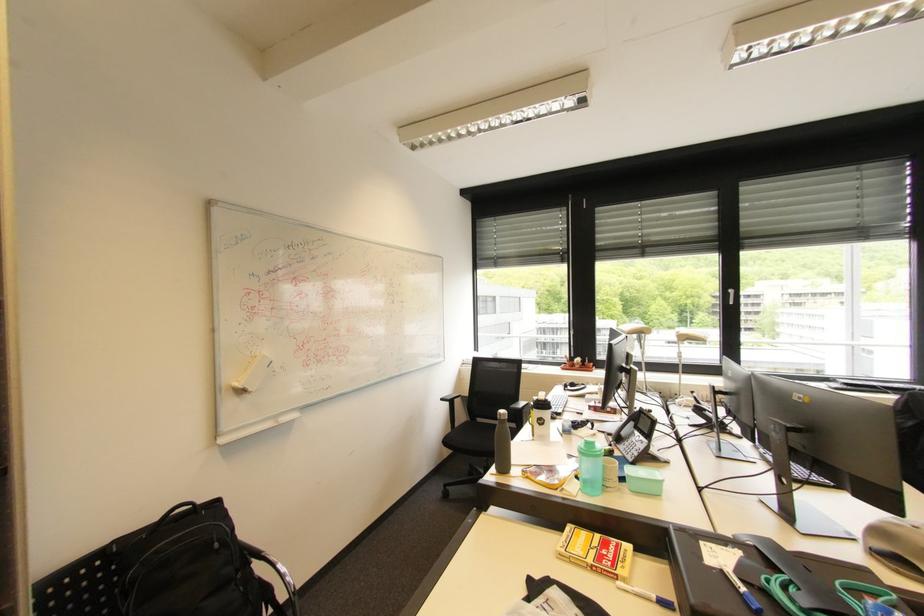
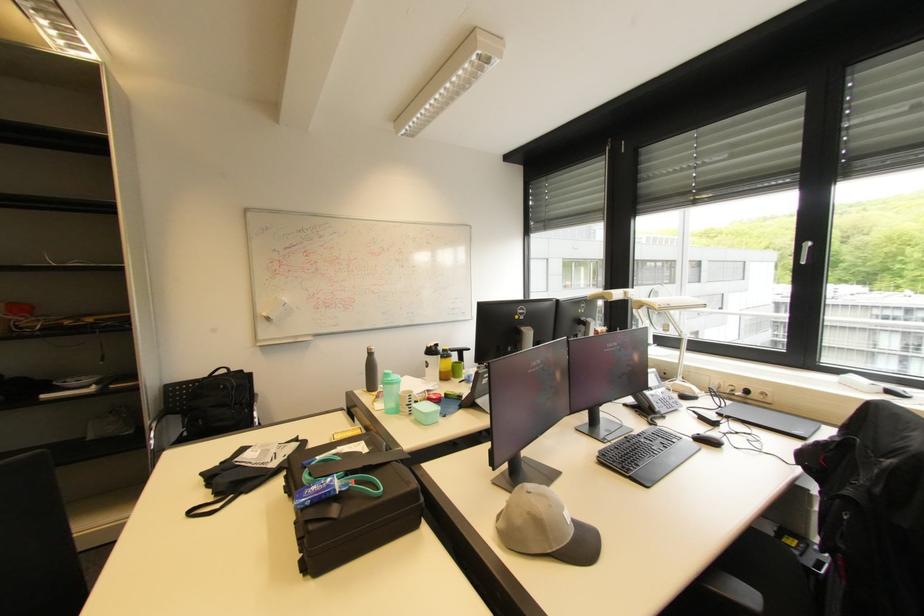
The point at (205,505) is marked in the first image. Where is the corresponding point in the second image?

(237, 371)